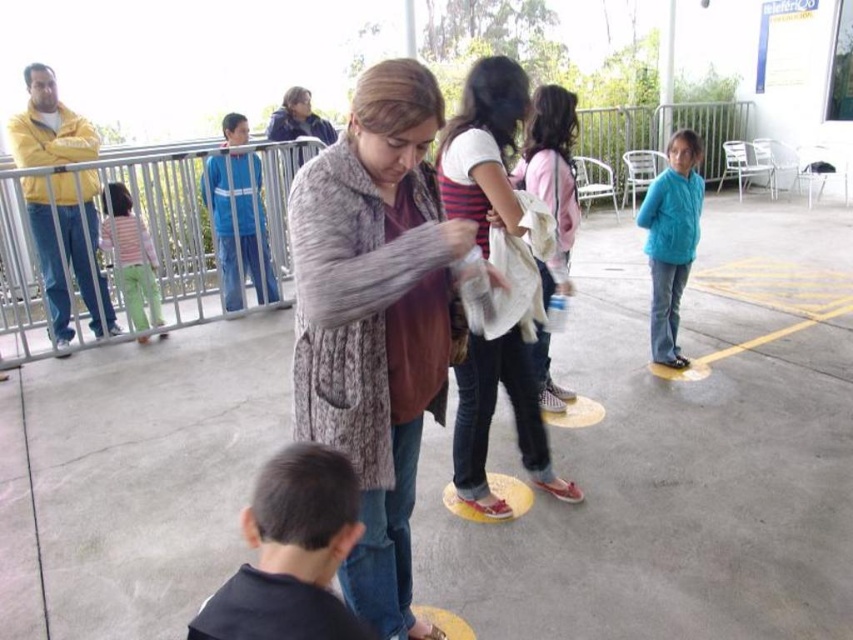
Looking at the outdoor event scene, where is the dark blue fabric at lower left in relation to the teal fleece jacket at right?

The dark blue fabric at lower left is to the left of the teal fleece jacket at right.

Looking at this image, you are a participant in an event and need to move from the metallic silver railing at left to the yellow painted line at lower right. Which object will you encounter first?

→ You will encounter the metallic silver railing at left first because it is closer to you than the yellow painted line at lower right.